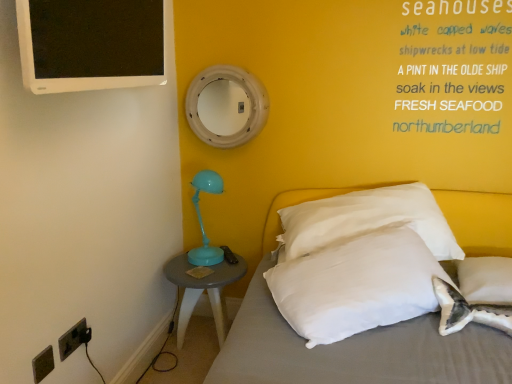
Where is `free point above matte gray side table at lower left (from a real-world perspective)`? The height and width of the screenshot is (384, 512). free point above matte gray side table at lower left (from a real-world perspective) is located at coordinates (208, 261).